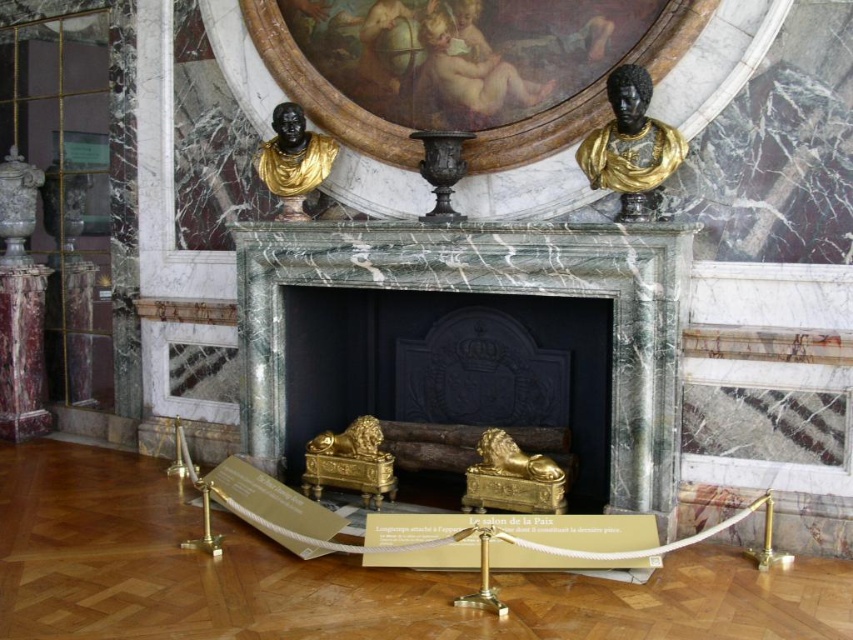
You are an interior designer assessing the symmetry of the fireplace area. The scene includes a black marble bust at upper right and a black marble bust at upper left. Which bust is positioned lower relative to the other?

The black marble bust at upper right is positioned lower than the black marble bust at upper left because it is described as being below it.

From the picture: You are an interior designer assessing the placement of furniture in a grand hall. The green marble fireplace at center is positioned at coordinates 0.458 on the x and 0.573 on the y. If you want to place a sofa directly in front of the fireplace, ensuring it is centered and aligned, what coordinates should the sofa be placed at?

The sofa should be placed directly in front of the green marble fireplace at center, which is located at coordinates x 0.458 and y 0.573. To center the sofa, it should be placed at the same x coordinate, 0.458, but slightly forward along the y axis, perhaps at y 0.6 or y 0.65, depending on the desired distance from the fireplace.